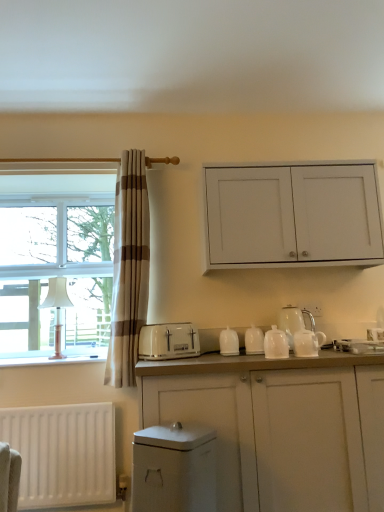
Locate an element on the screen. free point in front of white fabric lampshade at left is located at coordinates (42, 366).